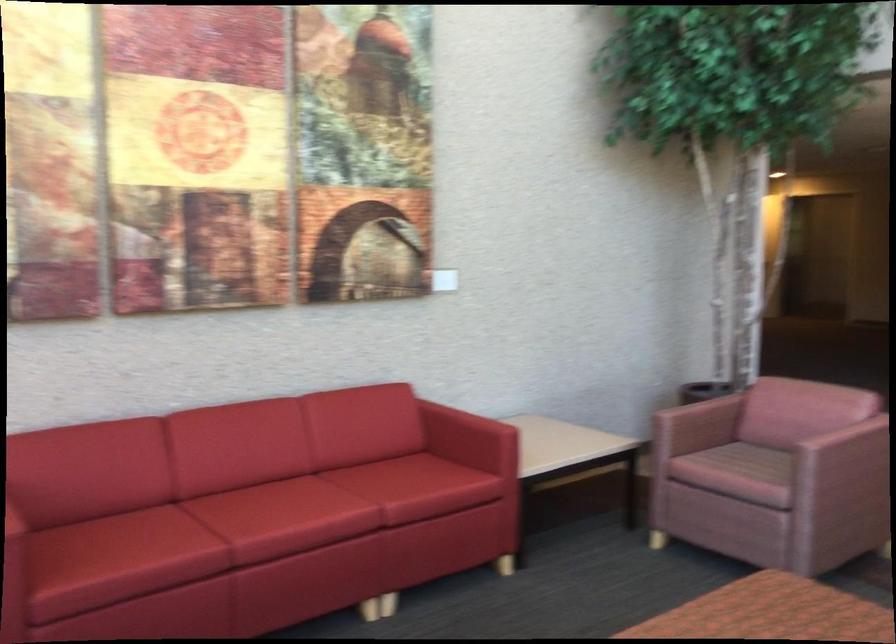
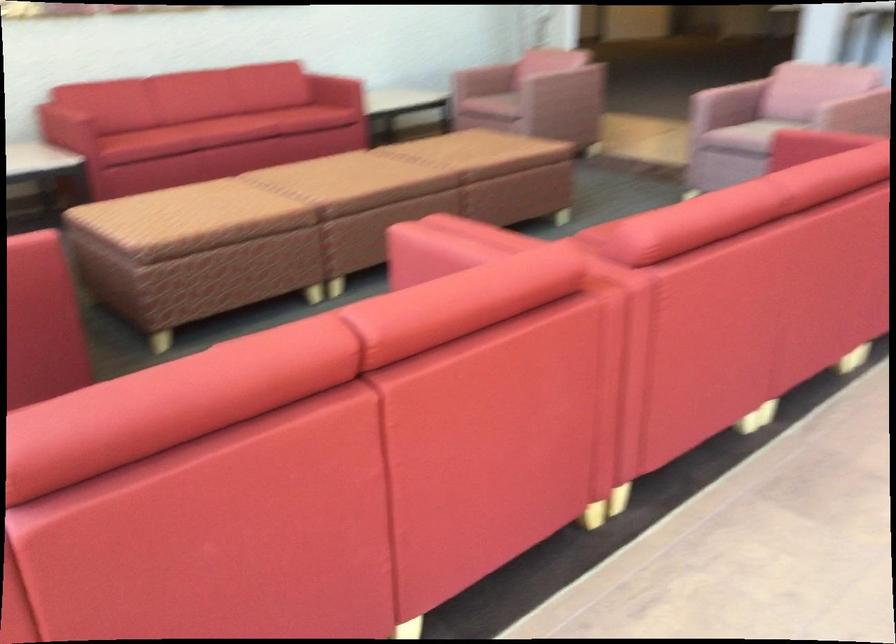
Question: In a continuous first-person perspective shot, in which direction is the camera moving?

Choices:
 (A) Left
 (B) Right
 (C) Forward
 (D) Backward

Answer: (D)